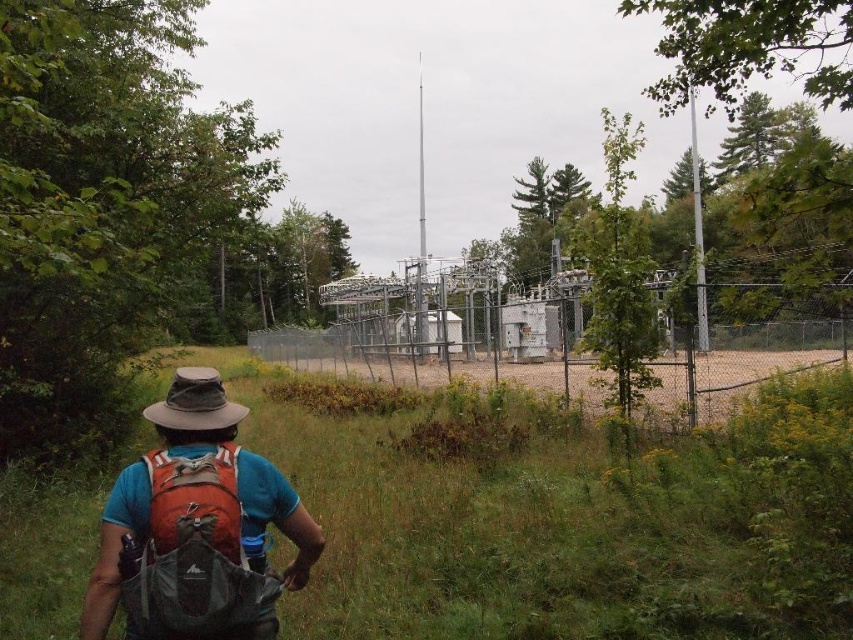
You are standing at the edge of the green grass at center and the brown sandy dirt field at center. You need to walk to the fenced industrial facility ahead. Which path should you take to minimize the distance walked?

The green grass at center is 13.54 feet away from the brown sandy dirt field at center. Since both paths lead to the facility, but the distance between them is fixed, you should choose either path as the total distance to the facility would be the same. However, if the facility is closer to one of the paths, that would be the shorter route. But based on the given information, the distance between the two paths themselves is 13.54 feet, so without knowing their positions relative to the facility, it is not

You are a hiker who wants to cross the area to reach the industrial facility. You have two options to walk on either the green grass at center or the brown sandy dirt field at center. Which surface would require you to lift your legs higher due to its height?

The brown sandy dirt field at center is taller than the green grass at center, so you would need to lift your legs higher when walking on the brown sandy dirt field at center.